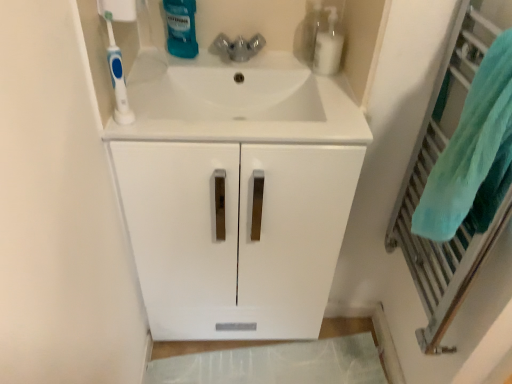
Image resolution: width=512 pixels, height=384 pixels. I want to click on free space behind blue plastic toothbrush at upper left, so click(x=153, y=92).